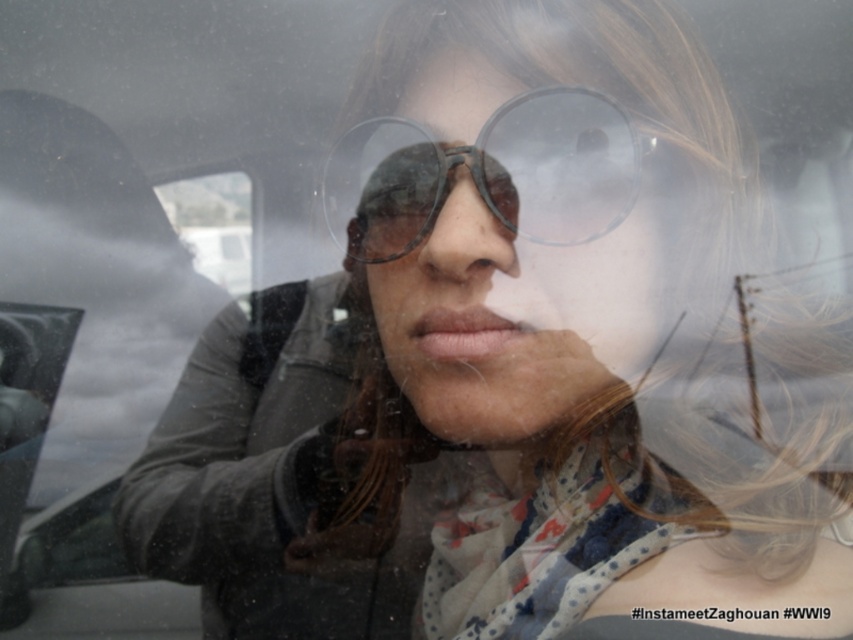
Is transparent plastic goggles at center behind matte plastic nose at center?

Yes, it is behind matte plastic nose at center.

Can you confirm if transparent plastic goggles at center is thinner than matte plastic nose at center?

In fact, transparent plastic goggles at center might be wider than matte plastic nose at center.

Is point (634, 180) positioned in front of point (459, 195)?

No, it is not.

Where is `transparent plastic goggles at center`? The image size is (853, 640). transparent plastic goggles at center is located at coordinates (488, 173).